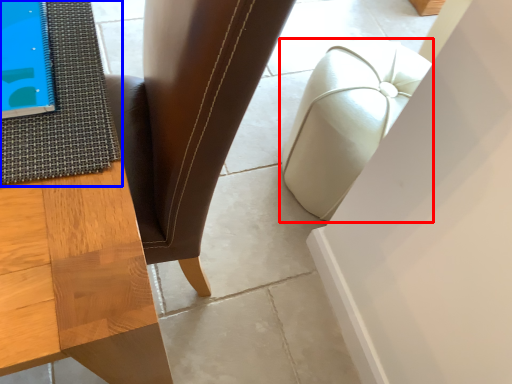
Question: Which object appears farthest to the camera in this image, furniture (highlighted by a red box) or mat (highlighted by a blue box)?

Choices:
 (A) furniture
 (B) mat

Answer: (A)